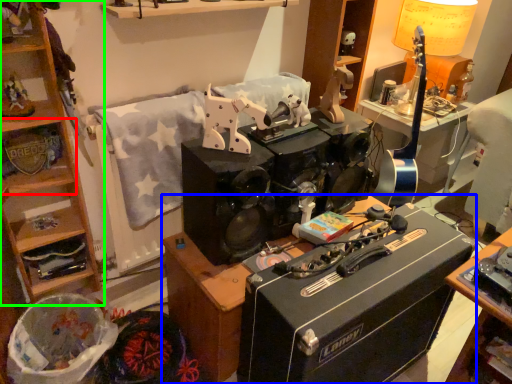
Question: Which object is positioned closest to shelf (highlighted by a red box)? Select from desk (highlighted by a blue box) and cabinetry (highlighted by a green box).

Choices:
 (A) desk
 (B) cabinetry

Answer: (B)